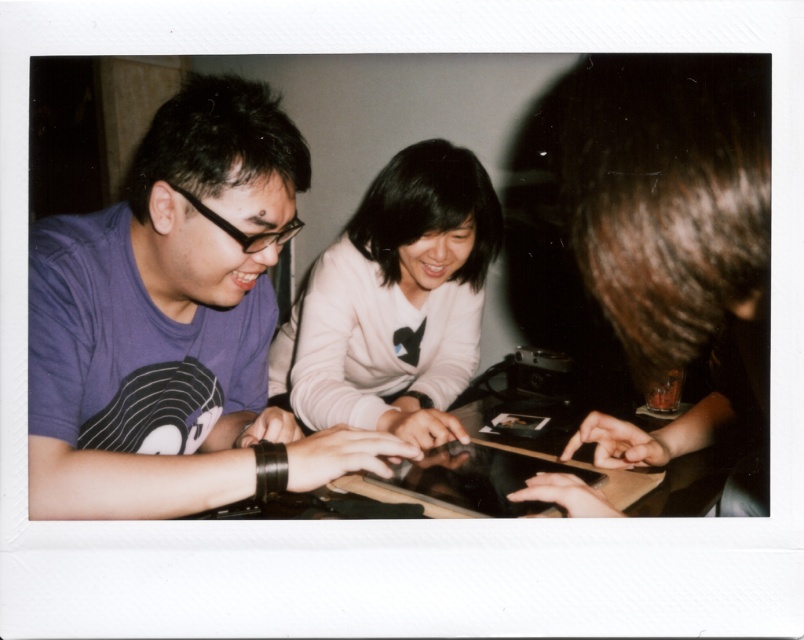
Can you confirm if purple matte shirt at left is smaller than white soft sweater at center?

Yes, purple matte shirt at left is smaller than white soft sweater at center.

Can you confirm if purple matte shirt at left is positioned below white soft sweater at center?

No.

Does point (91, 328) come in front of point (409, 154)?

That is True.

At what (x,y) coordinates should I click in order to perform the action: click on purple matte shirt at left. Please return your answer as a coordinate pair (x, y). Looking at the image, I should click on (175, 324).